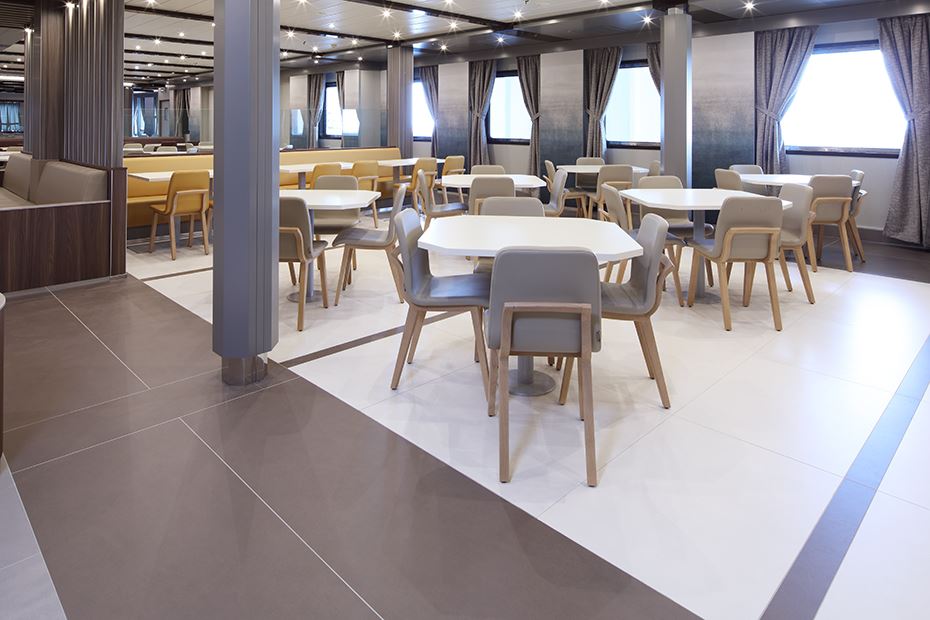
I want to click on window curtains, so click(906, 86), click(779, 76), click(654, 58), click(598, 73), click(532, 78), click(485, 81), click(429, 79), click(340, 84), click(317, 84), click(177, 95).